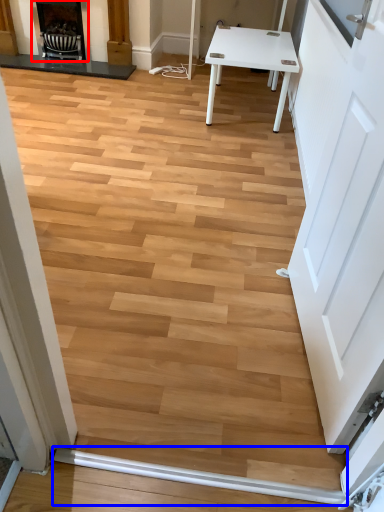
Question: Which object appears closest to the camera in this image, fireplace (highlighted by a red box) or beam (highlighted by a blue box)?

Choices:
 (A) fireplace
 (B) beam

Answer: (B)